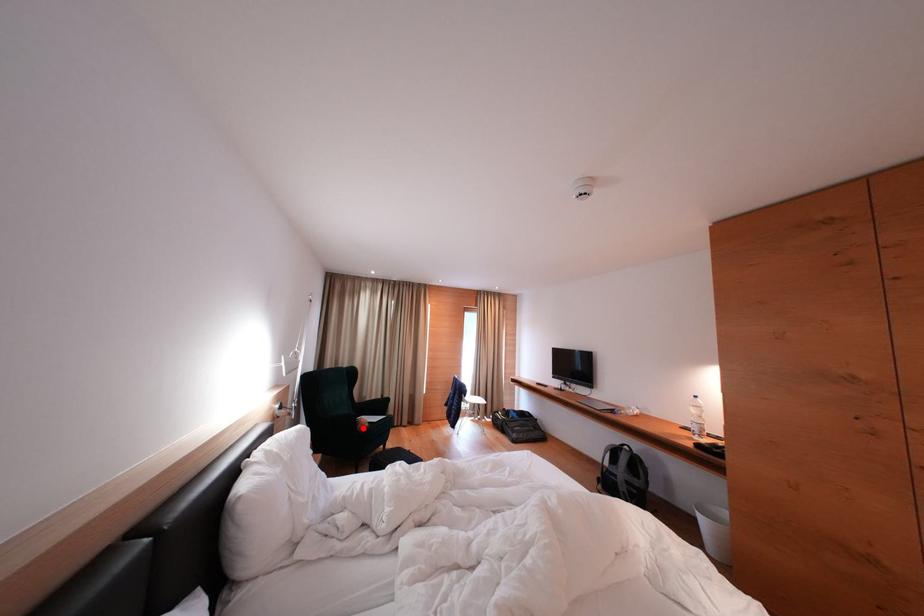
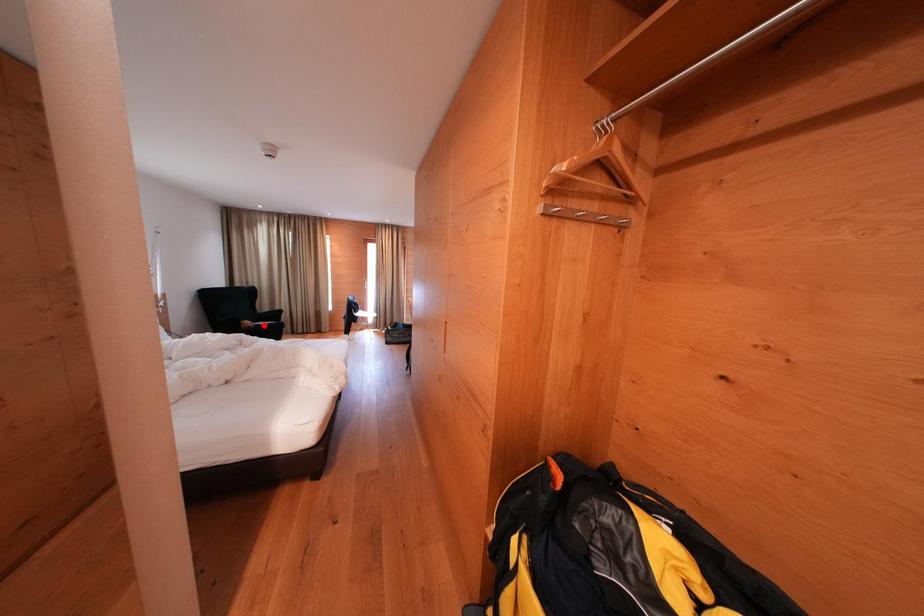
I am providing you with two images of the same scene from different viewpoints. A red point is marked on the first image and another point is marked on the second image. Is the red point in image1 aligned with the point shown in image2?

No